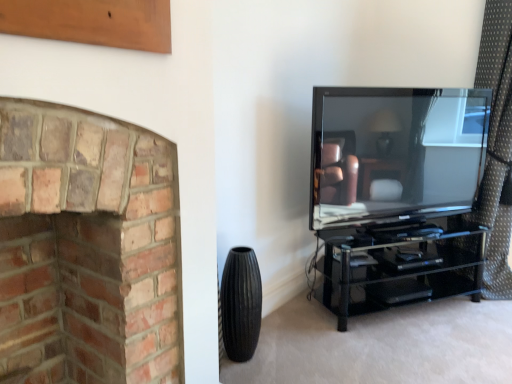
This screenshot has width=512, height=384. What do you see at coordinates (497, 146) in the screenshot?
I see `brown dotted fabric at right` at bounding box center [497, 146].

What do you see at coordinates (241, 304) in the screenshot? The image size is (512, 384). I see `black ribbed vase at lower center` at bounding box center [241, 304].

This screenshot has width=512, height=384. I want to click on brown dotted fabric at right, so click(497, 146).

Would you say matte black tv at right is a long distance from brown dotted fabric at right?

That's not correct — matte black tv at right is a little close to brown dotted fabric at right.

Does point (423, 91) come closer to viewer compared to point (506, 60)?

Yes, point (423, 91) is in front of point (506, 60).

The width and height of the screenshot is (512, 384). I want to click on television below the brown dotted fabric at right (from a real-world perspective), so click(395, 151).

Which of these two, matte black tv at right or brown dotted fabric at right, is wider?

Wider between the two is brown dotted fabric at right.

Could you tell me if black ribbed vase at lower center is turned towards brown dotted fabric at right?

No, black ribbed vase at lower center is not turned towards brown dotted fabric at right.

Between black ribbed vase at lower center and brown dotted fabric at right, which one has smaller size?

Smaller between the two is black ribbed vase at lower center.

From the image's perspective, which one is positioned lower, black ribbed vase at lower center or brown dotted fabric at right?

black ribbed vase at lower center appears lower in the image.

Which of these two, black ribbed vase at lower center or red brick fireplace at left, stands shorter?

black ribbed vase at lower center.

Based on the photo, is black ribbed vase at lower center touching red brick fireplace at left?

black ribbed vase at lower center and red brick fireplace at left are not in contact.

Which of these two, black ribbed vase at lower center or red brick fireplace at left, is smaller?

black ribbed vase at lower center.

Which object is wider, matte black tv at right or red brick fireplace at left?

With larger width is red brick fireplace at left.

Is matte black tv at right at the right side of red brick fireplace at left?

Correct, you'll find matte black tv at right to the right of red brick fireplace at left.

Consider the image. Is matte black tv at right directly adjacent to red brick fireplace at left?

No, matte black tv at right is not in contact with red brick fireplace at left.

From the image's perspective, which one is positioned higher, black ribbed vase at lower center or matte black tv at right?

matte black tv at right, from the image's perspective.

Is black ribbed vase at lower center not within matte black tv at right?

Absolutely, black ribbed vase at lower center is external to matte black tv at right.

Does point (244, 264) appear closer or farther from the camera than point (398, 184)?

Point (244, 264).

Considering the sizes of objects red brick fireplace at left and black ribbed vase at lower center in the image provided, who is wider, red brick fireplace at left or black ribbed vase at lower center?

red brick fireplace at left is wider.

Would you say red brick fireplace at left is outside black ribbed vase at lower center?

Yes, red brick fireplace at left is not within black ribbed vase at lower center.

Relative to black ribbed vase at lower center, is red brick fireplace at left in front or behind?

red brick fireplace at left is positioned closer to the viewer than black ribbed vase at lower center.

Which is behind, point (14, 246) or point (232, 259)?

The point (232, 259) is farther from the camera.

From the image's perspective, which is above, brown dotted fabric at right or matte black tv at right?

From the image's view, brown dotted fabric at right is above.

Considering the sizes of brown dotted fabric at right and matte black tv at right in the image, is brown dotted fabric at right wider or thinner than matte black tv at right?

Clearly, brown dotted fabric at right has more width compared to matte black tv at right.

Is brown dotted fabric at right turned away from matte black tv at right?

brown dotted fabric at right is not turned away from matte black tv at right.

Visually, is brown dotted fabric at right positioned to the left or to the right of matte black tv at right?

From the image, it's evident that brown dotted fabric at right is to the right of matte black tv at right.

The height and width of the screenshot is (384, 512). Find the location of `television that is below the brown dotted fabric at right (from the image's perspective)`. television that is below the brown dotted fabric at right (from the image's perspective) is located at coordinates (395, 151).

Identify the location of tire in front of the brown dotted fabric at right. This screenshot has width=512, height=384. (241, 304).

From the image, which object appears to be nearer to red brick fireplace at left, brown dotted fabric at right or black ribbed vase at lower center?

black ribbed vase at lower center is positioned closer to the anchor red brick fireplace at left.

From the image, which object appears to be farther from black ribbed vase at lower center, matte black tv at right or red brick fireplace at left?

matte black tv at right.

Considering their positions, is black ribbed vase at lower center positioned closer to brown dotted fabric at right than matte black tv at right?

Among the two, matte black tv at right is located nearer to brown dotted fabric at right.

Based on their spatial positions, is red brick fireplace at left or black ribbed vase at lower center closer to brown dotted fabric at right?

black ribbed vase at lower center is positioned closer to the anchor brown dotted fabric at right.

When comparing their distances from black ribbed vase at lower center, does matte black tv at right or brown dotted fabric at right seem closer?

matte black tv at right.

Looking at the image, which one is located further to matte black tv at right, red brick fireplace at left or brown dotted fabric at right?

red brick fireplace at left is positioned further to the anchor matte black tv at right.

Looking at the image, which one is located closer to red brick fireplace at left, matte black tv at right or black ribbed vase at lower center?

black ribbed vase at lower center lies closer to red brick fireplace at left than the other object.

Estimate the real-world distances between objects in this image. Which object is further from matte black tv at right, brown dotted fabric at right or black ribbed vase at lower center?

black ribbed vase at lower center lies further to matte black tv at right than the other object.

The image size is (512, 384). I want to click on tire located between red brick fireplace at left and brown dotted fabric at right in the left-right direction, so click(241, 304).

Find the location of a particular element. The image size is (512, 384). television located between red brick fireplace at left and brown dotted fabric at right in the left-right direction is located at coordinates (395, 151).

This screenshot has height=384, width=512. I want to click on tire situated between red brick fireplace at left and matte black tv at right from left to right, so click(x=241, y=304).

Locate an element on the screen. The height and width of the screenshot is (384, 512). television between black ribbed vase at lower center and brown dotted fabric at right from left to right is located at coordinates (395, 151).